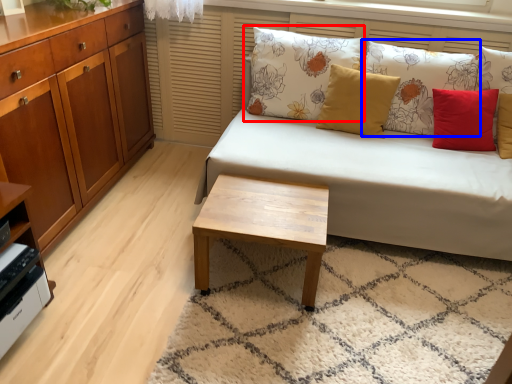
Question: Which point is further to the camera, pillow (highlighted by a red box) or pillow (highlighted by a blue box)?

Choices:
 (A) pillow
 (B) pillow

Answer: (A)